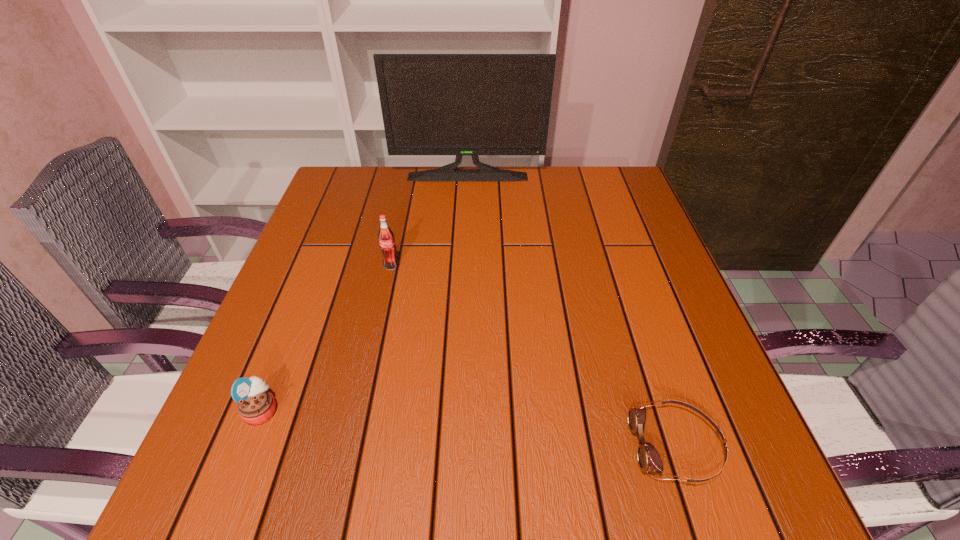
You are a GUI agent. You are given a task and a screenshot of the screen. Output one action in this format:
    pyautogui.click(x=<x>, y=<y>)
    Task: Click on the free spot located on the front-facing side of the second shortest object
    The image size is (960, 540).
    Given the screenshot: What is the action you would take?
    pyautogui.click(x=487, y=410)

This screenshot has width=960, height=540. Find the location of `blank space located through the lenses of the goggles`. blank space located through the lenses of the goggles is located at coordinates click(485, 446).

You are a GUI agent. You are given a task and a screenshot of the screen. Output one action in this format:
    pyautogui.click(x=<x>, y=<y>)
    Task: Click on the vacant space located through the lenses of the goggles
    Image resolution: width=960 pixels, height=540 pixels.
    Given the screenshot: What is the action you would take?
    pyautogui.click(x=442, y=446)

The height and width of the screenshot is (540, 960). Find the location of `free region located 0.080m through the lenses of the goggles`. free region located 0.080m through the lenses of the goggles is located at coordinates (583, 446).

Locate an element on the screen. This screenshot has height=540, width=960. object present at the far edge is located at coordinates (432, 104).

At what (x,y) coordinates should I click in order to perform the action: click on object located at the near edge. Please return your answer as a coordinate pair (x, y). This screenshot has height=540, width=960. Looking at the image, I should click on (649, 459).

Find the location of a particular element. The image size is (960, 540). object that is at the left edge is located at coordinates (256, 405).

Locate an element on the screen. The height and width of the screenshot is (540, 960). object located in the right edge section of the desktop is located at coordinates (649, 459).

Where is `object present at the near right corner`? This screenshot has width=960, height=540. object present at the near right corner is located at coordinates (649, 459).

In the image, there is a desktop. At what (x,y) coordinates should I click in order to perform the action: click on free space at the far edge. Please return your answer as a coordinate pair (x, y). This screenshot has height=540, width=960. Looking at the image, I should click on (496, 197).